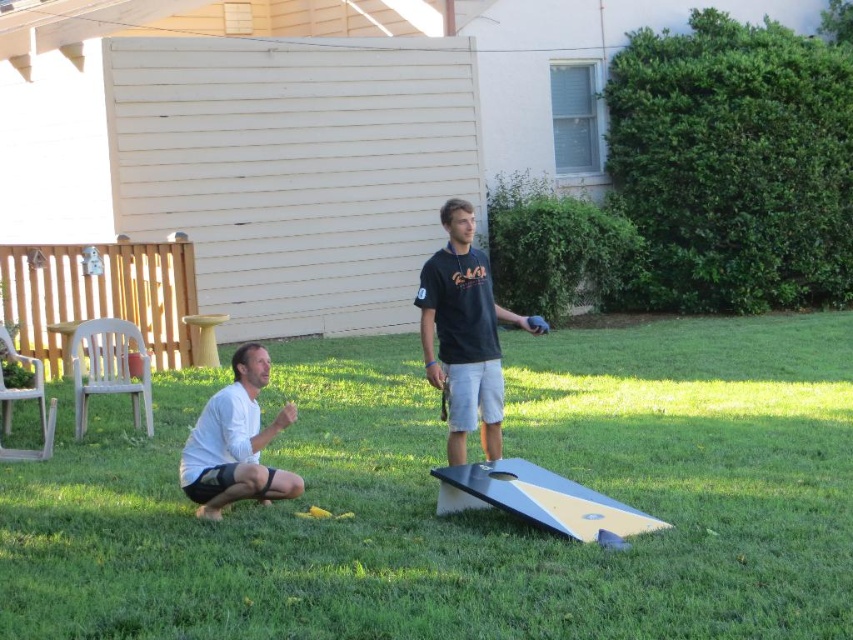
You are standing in the backyard and see the black matte shirt at center and the white matte shorts at lower left. Which of these two items is closer to you?

The black matte shirt at center is closer to you because the white matte shorts at lower left is behind it.